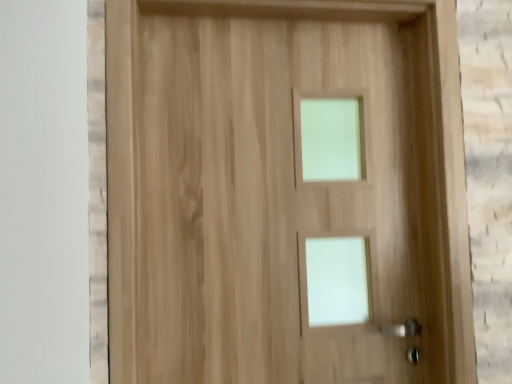
Image resolution: width=512 pixels, height=384 pixels. What do you see at coordinates (268, 188) in the screenshot? I see `natural wood door at center` at bounding box center [268, 188].

Image resolution: width=512 pixels, height=384 pixels. I want to click on natural wood door at center, so tap(268, 188).

Find the location of `natural wood door at center`. natural wood door at center is located at coordinates (268, 188).